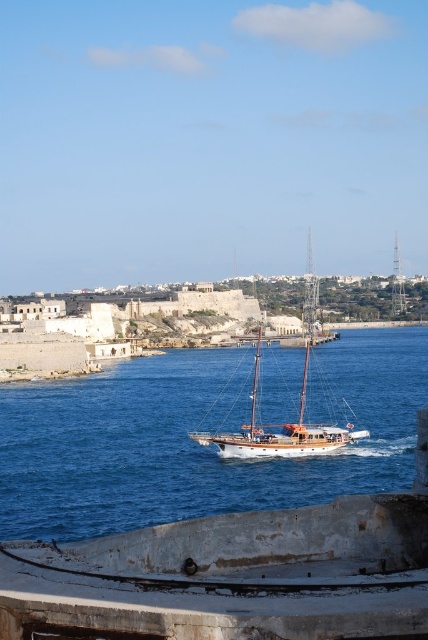
You are standing on the concrete structure in the foreground of the maritime scene. You want to throw a small pebble into the blue water at center. Based on the coordinates provided, in which direction should you aim relative to your position?

The blue water at center is located at coordinates point (195, 442), so you should aim towards the lower right direction relative to your position on the concrete structure.

You are a photographer planning to capture the blue water at center and the wooden sailboat at center in a single frame. Based on the scene, which object would occupy more horizontal space in your photo?

The blue water at center occupies more horizontal space in the photo because its width is larger than that of the wooden sailboat at center.